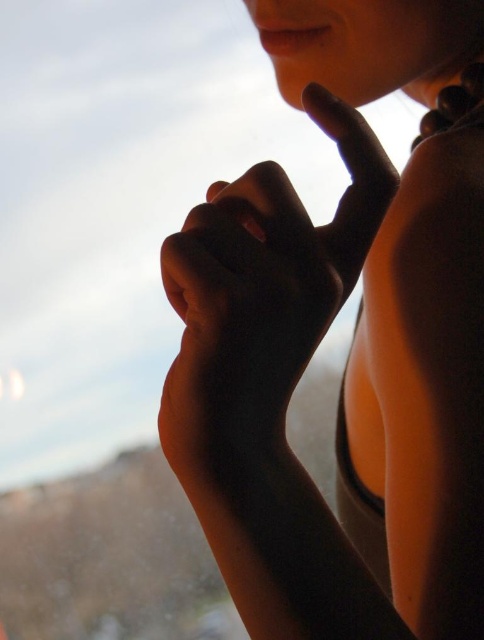
Looking at this image, which is below, smooth skin at center or smooth skin hand at center?

Positioned lower is smooth skin at center.

Does smooth skin at center have a greater width compared to smooth skin hand at center?

Indeed, smooth skin at center has a greater width compared to smooth skin hand at center.

Locate an element on the screen. smooth skin at center is located at coordinates (352, 339).

This screenshot has width=484, height=640. I want to click on smooth skin at center, so click(352, 339).